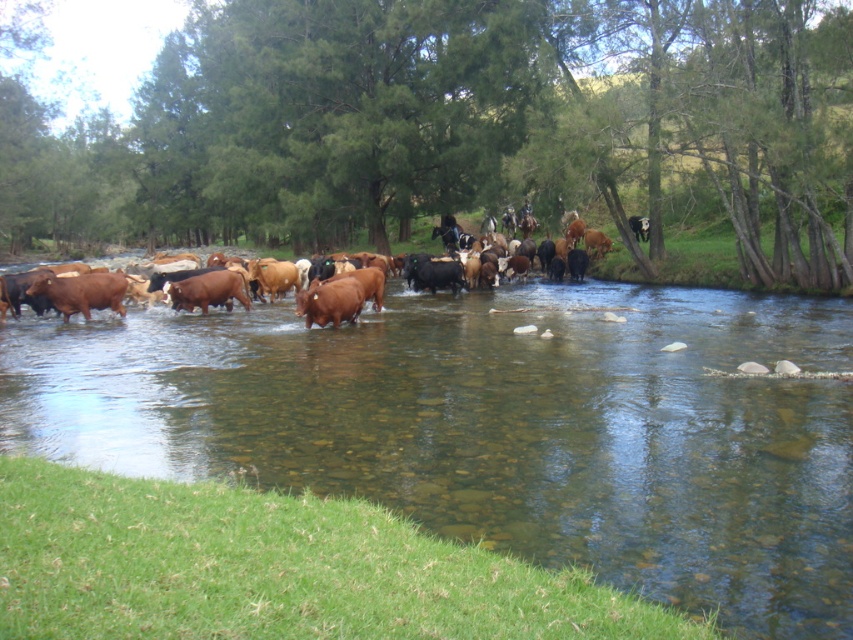
Question: Can you confirm if brown matte cow at center is positioned below brown glossy cows at center?

Choices:
 (A) yes
 (B) no

Answer: (A)

Question: Considering the real-world distances, which object is farthest from the brown matte cow at center?

Choices:
 (A) brown glossy cows at center
 (B) clear water stream at center

Answer: (A)

Question: Which object is positioned closest to the brown glossy cows at center?

Choices:
 (A) clear water stream at center
 (B) brown matte cow at center

Answer: (B)

Question: Which object appears closest to the camera in this image?

Choices:
 (A) brown matte cow at center
 (B) clear water stream at center
 (C) brown glossy cows at center

Answer: (B)

Question: Can you confirm if brown matte cow at center is bigger than brown glossy cows at center?

Choices:
 (A) yes
 (B) no

Answer: (B)

Question: Is brown matte cow at center to the right of brown glossy cows at center from the viewer's perspective?

Choices:
 (A) yes
 (B) no

Answer: (B)